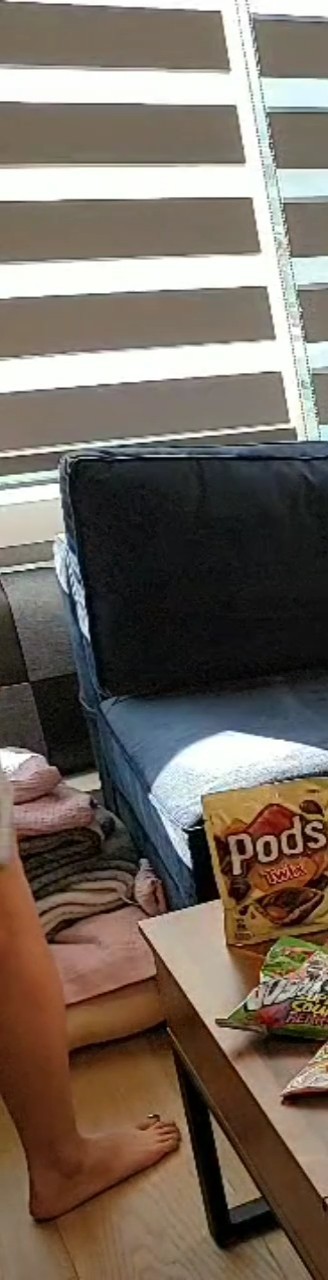
At what (x,y) coordinates should I click in order to perform the action: click on blanket. Please return your answer as a coordinate pair (x, y). Looking at the image, I should click on coord(39,818).